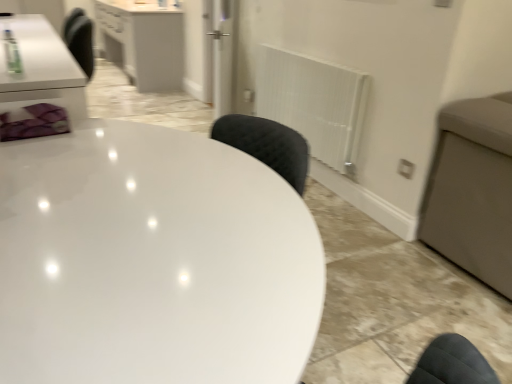
Question: Is transparent glass door at center inside white glossy cabinet at upper left?

Choices:
 (A) no
 (B) yes

Answer: (A)

Question: Is white glossy cabinet at upper left outside transparent glass door at center?

Choices:
 (A) yes
 (B) no

Answer: (A)

Question: Is white glossy cabinet at upper left thinner than transparent glass door at center?

Choices:
 (A) no
 (B) yes

Answer: (A)

Question: Can you confirm if white glossy cabinet at upper left is wider than transparent glass door at center?

Choices:
 (A) no
 (B) yes

Answer: (B)

Question: Does white glossy cabinet at upper left touch transparent glass door at center?

Choices:
 (A) no
 (B) yes

Answer: (A)

Question: From the image's perspective, is white glossy cabinet at upper left positioned above or below white textured radiator at center right?

Choices:
 (A) above
 (B) below

Answer: (A)

Question: From their relative heights in the image, would you say white glossy cabinet at upper left is taller or shorter than white textured radiator at center right?

Choices:
 (A) short
 (B) tall

Answer: (B)

Question: Is point (145, 79) positioned closer to the camera than point (364, 89)?

Choices:
 (A) closer
 (B) farther

Answer: (B)

Question: Visually, is white glossy cabinet at upper left positioned to the left or to the right of white textured radiator at center right?

Choices:
 (A) right
 (B) left

Answer: (B)

Question: Looking at the image, does white textured radiator at center right seem bigger or smaller compared to white glossy cabinet at upper left?

Choices:
 (A) small
 (B) big

Answer: (A)

Question: From their relative heights in the image, would you say white textured radiator at center right is taller or shorter than white glossy cabinet at upper left?

Choices:
 (A) short
 (B) tall

Answer: (A)

Question: From the image's perspective, is white textured radiator at center right located above or below white glossy cabinet at upper left?

Choices:
 (A) above
 (B) below

Answer: (B)

Question: From a real-world perspective, is white textured radiator at center right physically located above or below white glossy cabinet at upper left?

Choices:
 (A) below
 (B) above

Answer: (B)

Question: Which is correct: white glossy table at center is inside white glossy cabinet at upper left, or outside of it?

Choices:
 (A) inside
 (B) outside

Answer: (B)

Question: From their relative heights in the image, would you say white glossy table at center is taller or shorter than white glossy cabinet at upper left?

Choices:
 (A) short
 (B) tall

Answer: (A)